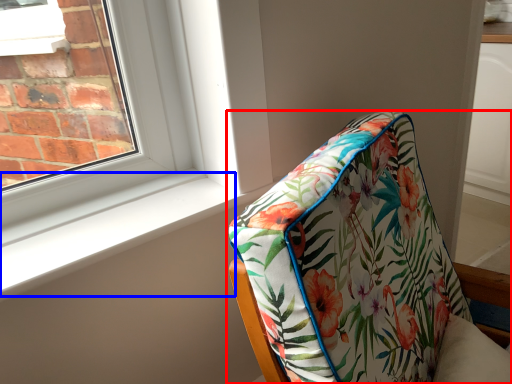
Question: Which object is further to the camera taking this photo, furniture (highlighted by a red box) or window sill (highlighted by a blue box)?

Choices:
 (A) furniture
 (B) window sill

Answer: (B)